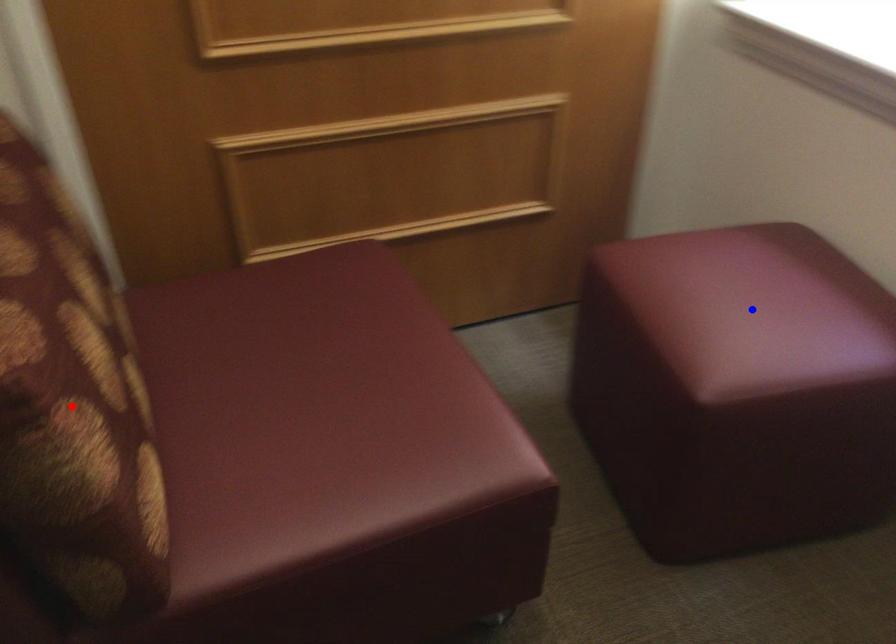
Question: Which of the two points in the image is closer to the camera?

Choices:
 (A) Blue point is closer.
 (B) Red point is closer.

Answer: (B)